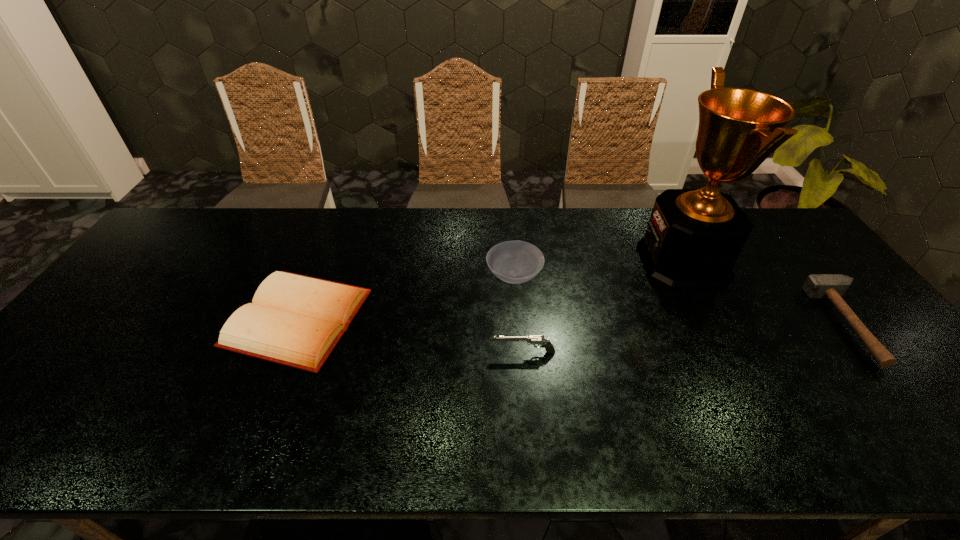
Where is `blank space at the near edge`? The width and height of the screenshot is (960, 540). blank space at the near edge is located at coordinates coord(462,422).

Find the location of a particular element. vacant space at the left edge is located at coordinates (46, 379).

Image resolution: width=960 pixels, height=540 pixels. Identify the location of vacant area at the right edge. pos(901,412).

The width and height of the screenshot is (960, 540). Find the location of `vacant space at the far right corner of the desktop`. vacant space at the far right corner of the desktop is located at coordinates (809, 251).

At what (x,y) coordinates should I click in order to perform the action: click on free location at the near right corner. Please return your answer as a coordinate pair (x, y). Looking at the image, I should click on (907, 444).

Identify the location of vacant point located between the bowl and the second object from right to left. (598, 269).

Locate an element on the screen. Image resolution: width=960 pixels, height=540 pixels. free space between the rightmost object and the leftmost object is located at coordinates (574, 321).

Where is `free space between the second object from right to left and the bowl`? free space between the second object from right to left and the bowl is located at coordinates (598, 269).

Identify the location of free spot between the rightmost object and the fourth object from left to right. This screenshot has width=960, height=540. (766, 293).

Find the location of a particular element. The image size is (960, 540). free area in between the bowl and the rightmost object is located at coordinates (683, 300).